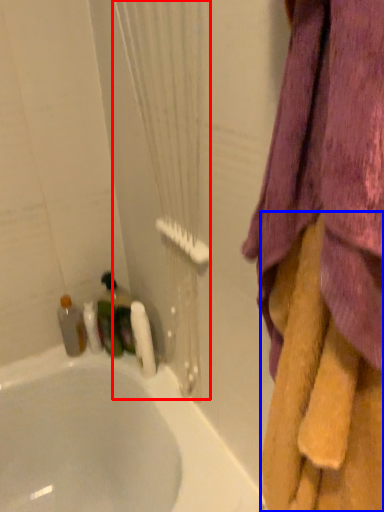
Question: Which point is closer to the camera, shower curtain (highlighted by a red box) or towel (highlighted by a blue box)?

Choices:
 (A) shower curtain
 (B) towel

Answer: (B)